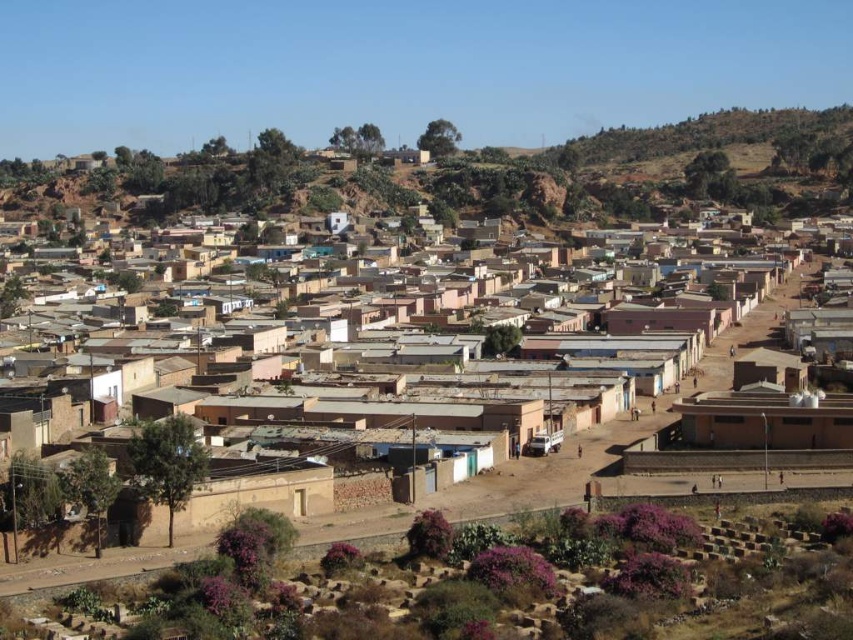
You are a delivery person trying to navigate through the narrow streets between the brown mud hut at lower left and the brown clay hut at lower right. Can you pass through the space between them?

The brown mud hut at lower left has a lesser width compared to brown clay hut at lower right. Since the mud hut is narrower, there might be enough space to pass through the narrow streets between them, but the exact width isn

You are standing in the middle of the urban area and want to take a photo of both the brown mud hut at lower left and the brown clay hut at lower right. Which hut should you move towards to get both in the frame without changing your camera angle?

You should move towards the brown mud hut at lower left because it is closer to you than the brown clay hut at lower right, so adjusting your position towards it will keep both huts within the camera frame.